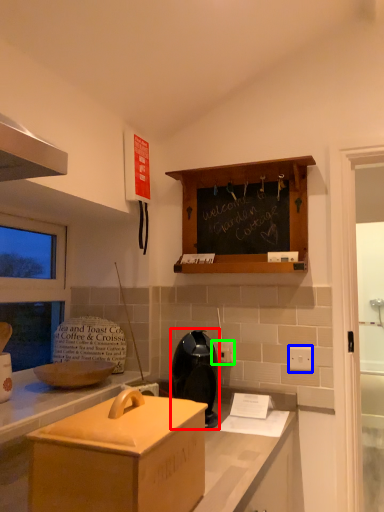
Question: Which object is the farthest from appliance (highlighted by a red box)? Choose among these: electric outlet (highlighted by a blue box) or electric outlet (highlighted by a green box).

Choices:
 (A) electric outlet
 (B) electric outlet

Answer: (A)